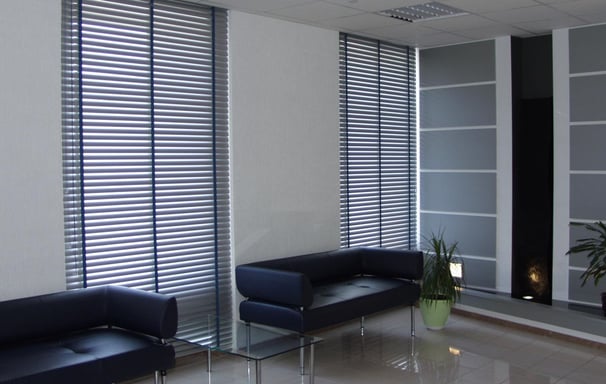
Where is `table`? table is located at coordinates (265, 333).